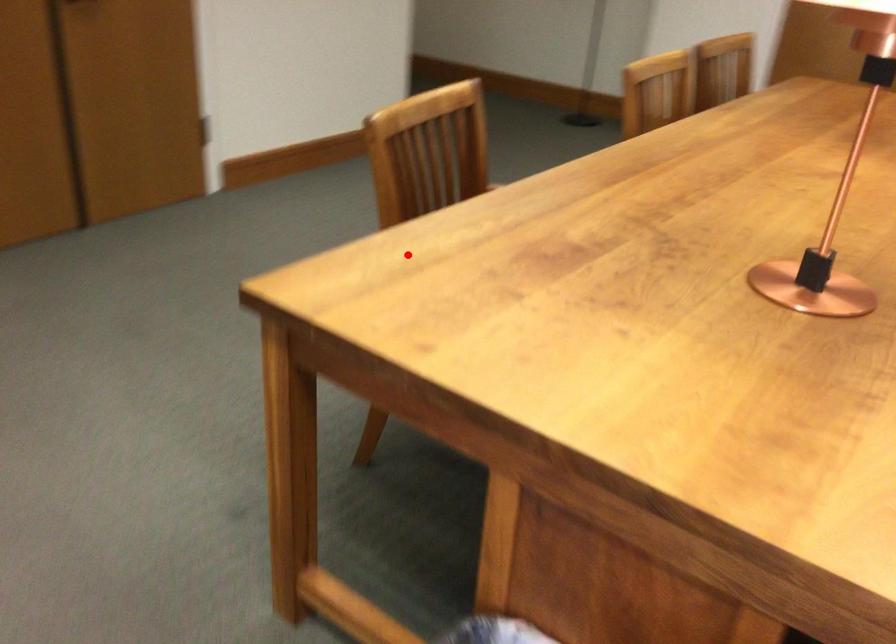
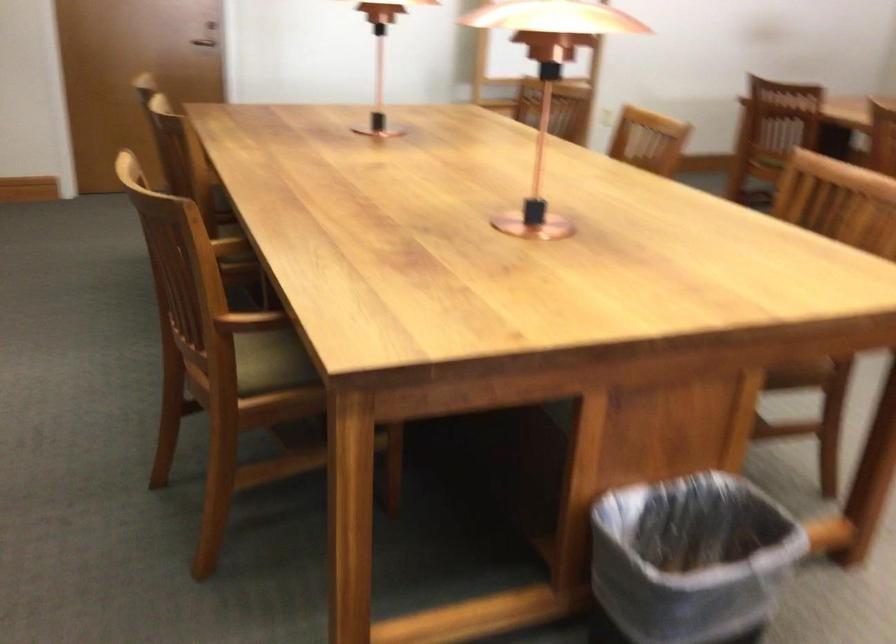
The point at the highlighted location is marked in the first image. Where is the corresponding point in the second image?

(250, 321)